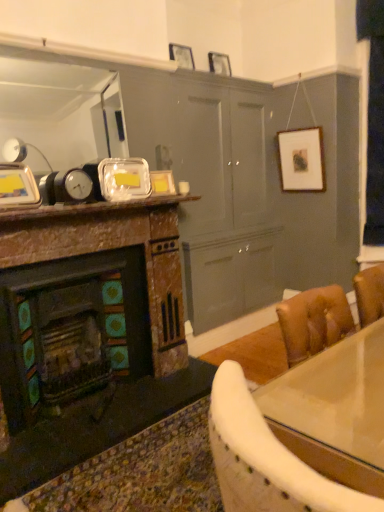
Question: Can you confirm if shiny glass table at lower right is smaller than rustic stone fireplace at left?

Choices:
 (A) no
 (B) yes

Answer: (B)

Question: Is shiny glass table at lower right positioned before rustic stone fireplace at left?

Choices:
 (A) no
 (B) yes

Answer: (B)

Question: Could you tell me if shiny glass table at lower right is facing rustic stone fireplace at left?

Choices:
 (A) yes
 (B) no

Answer: (B)

Question: Would you say shiny glass table at lower right contains rustic stone fireplace at left?

Choices:
 (A) no
 (B) yes

Answer: (A)

Question: Is shiny glass table at lower right not near rustic stone fireplace at left?

Choices:
 (A) no
 (B) yes

Answer: (B)

Question: Is point (180, 55) closer or farther from the camera than point (180, 193)?

Choices:
 (A) farther
 (B) closer

Answer: (A)

Question: Considering the positions of wooden picture frame at upper center, which ranks as the 3th picture frame in back-to-front order, and white glossy coffee cup at center in the image, is wooden picture frame at upper center, which ranks as the 3th picture frame in back-to-front order, taller or shorter than white glossy coffee cup at center?

Choices:
 (A) short
 (B) tall

Answer: (B)

Question: From the image's perspective, is wooden picture frame at upper center, the third picture frame viewed from the right, positioned above or below white glossy coffee cup at center?

Choices:
 (A) below
 (B) above

Answer: (B)

Question: Looking at their shapes, would you say wooden picture frame at upper center, arranged as the 3th picture frame when viewed from the left, is wider or thinner than white glossy coffee cup at center?

Choices:
 (A) thin
 (B) wide

Answer: (A)

Question: Is metallic silver picture frame at upper left, the 1th picture frame from the bottom, spatially inside matte glass picture frame at upper center, which is the second picture frame in left-to-right order, or outside of it?

Choices:
 (A) outside
 (B) inside

Answer: (A)

Question: Does point (23, 174) appear closer or farther from the camera than point (158, 188)?

Choices:
 (A) farther
 (B) closer

Answer: (B)

Question: Considering the positions of metallic silver picture frame at upper left, the first picture frame from the left, and matte glass picture frame at upper center, which is the second picture frame in left-to-right order, in the image, is metallic silver picture frame at upper left, the first picture frame from the left, taller or shorter than matte glass picture frame at upper center, which is the second picture frame in left-to-right order,?

Choices:
 (A) short
 (B) tall

Answer: (B)

Question: Considering the positions of metallic silver picture frame at upper left, the first picture frame from the left, and matte glass picture frame at upper center, which is counted as the 4th picture frame, starting from the top, in the image, is metallic silver picture frame at upper left, the first picture frame from the left, wider or thinner than matte glass picture frame at upper center, which is counted as the 4th picture frame, starting from the top,?

Choices:
 (A) wide
 (B) thin

Answer: (A)

Question: From their relative heights in the image, would you say shiny glass table at lower right is taller or shorter than matte silver picture frame at upper center, which is counted as the first picture frame, starting from the back?

Choices:
 (A) short
 (B) tall

Answer: (B)

Question: From the image's perspective, is shiny glass table at lower right positioned above or below matte silver picture frame at upper center, which is the 4th picture frame in left-to-right order?

Choices:
 (A) above
 (B) below

Answer: (B)